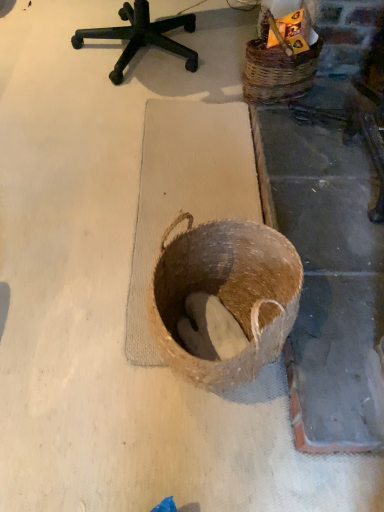
Question: Is woven brown basket at upper right, the second basket when ordered from bottom to top, surrounding wooden crate at upper right?

Choices:
 (A) no
 (B) yes

Answer: (B)

Question: Is woven brown basket at upper right, positioned as the 1th basket in top-to-bottom order, thinner than wooden crate at upper right?

Choices:
 (A) no
 (B) yes

Answer: (A)

Question: From a real-world perspective, is woven brown basket at upper right, which ranks as the first basket in back-to-front order, over wooden crate at upper right?

Choices:
 (A) yes
 (B) no

Answer: (B)

Question: From the image's perspective, is woven brown basket at upper right, which is the second basket from front to back, on wooden crate at upper right?

Choices:
 (A) no
 (B) yes

Answer: (A)

Question: From the image's perspective, would you say woven brown basket at upper right, which is the second basket from front to back, is shown under wooden crate at upper right?

Choices:
 (A) no
 (B) yes

Answer: (B)

Question: Visually, is wooden crate at upper right positioned to the left or to the right of brown woven basket at center, which ranks as the 1th basket in bottom-to-top order?

Choices:
 (A) right
 (B) left

Answer: (A)

Question: From their relative heights in the image, would you say wooden crate at upper right is taller or shorter than brown woven basket at center, the 2th basket from the back?

Choices:
 (A) short
 (B) tall

Answer: (A)

Question: Looking at their shapes, would you say wooden crate at upper right is wider or thinner than brown woven basket at center, which is counted as the second basket, starting from the right?

Choices:
 (A) thin
 (B) wide

Answer: (A)

Question: From a real-world perspective, is wooden crate at upper right physically located above or below brown woven basket at center, the 2th basket in the top-to-bottom sequence?

Choices:
 (A) above
 (B) below

Answer: (A)

Question: From the image's perspective, is woven brown basket at upper right, which ranks as the first basket in back-to-front order, positioned above or below wooden crate at upper right?

Choices:
 (A) below
 (B) above

Answer: (A)

Question: From a real-world perspective, is woven brown basket at upper right, which ranks as the second basket in left-to-right order, physically located above or below wooden crate at upper right?

Choices:
 (A) below
 (B) above

Answer: (A)

Question: Would you say woven brown basket at upper right, positioned as the 1th basket in top-to-bottom order, is to the left or to the right of wooden crate at upper right in the picture?

Choices:
 (A) left
 (B) right

Answer: (A)

Question: In the image, is woven brown basket at upper right, which ranks as the second basket in left-to-right order, positioned in front of or behind wooden crate at upper right?

Choices:
 (A) behind
 (B) front

Answer: (B)

Question: Considering the positions of brown woven basket at center, the 1th basket in the front-to-back sequence, and woven brown basket at upper right, which ranks as the first basket in right-to-left order, in the image, is brown woven basket at center, the 1th basket in the front-to-back sequence, wider or thinner than woven brown basket at upper right, which ranks as the first basket in right-to-left order,?

Choices:
 (A) thin
 (B) wide

Answer: (B)

Question: Considering the positions of point (281, 342) and point (251, 42), is point (281, 342) closer or farther from the camera than point (251, 42)?

Choices:
 (A) closer
 (B) farther

Answer: (A)